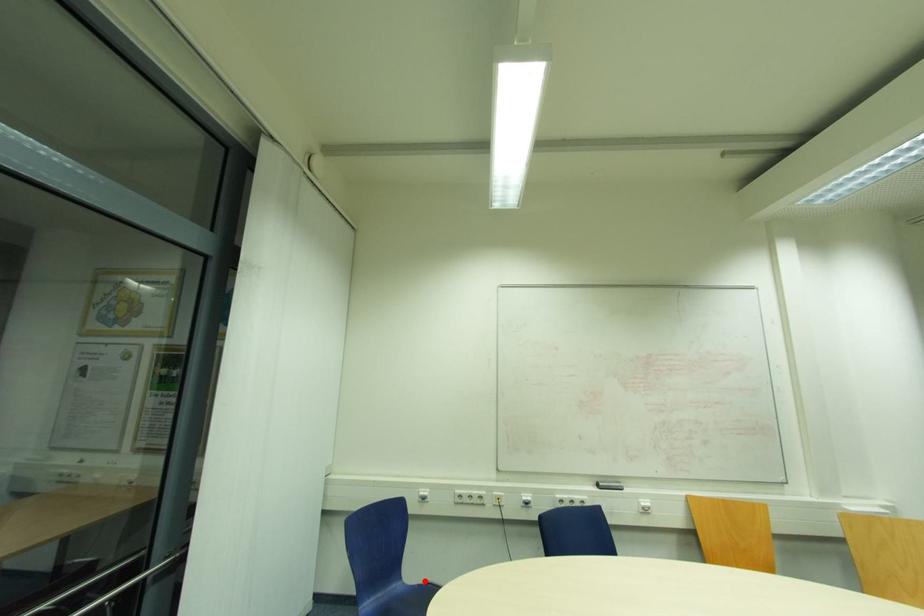
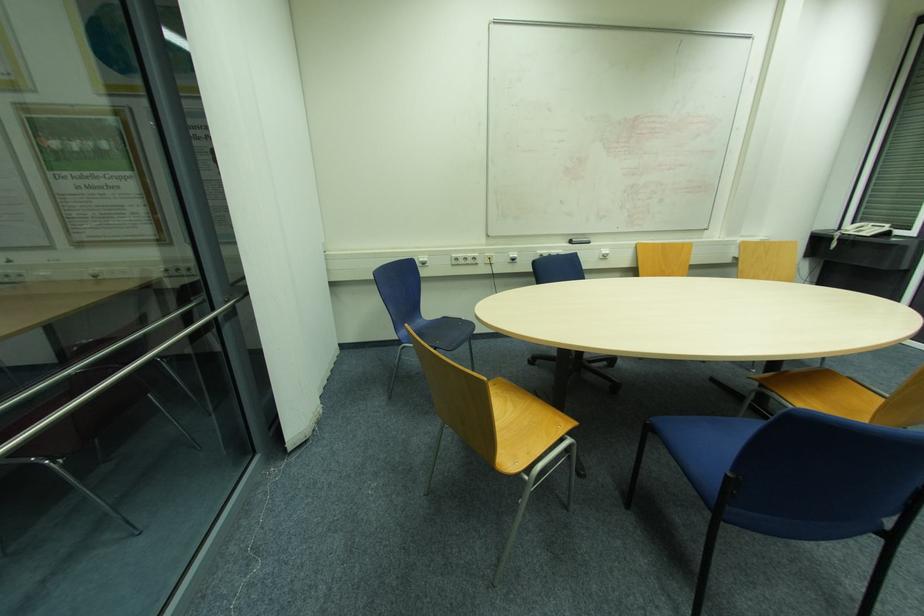
In the second image, find the point that corresponds to the highlighted location in the first image.

(440, 317)